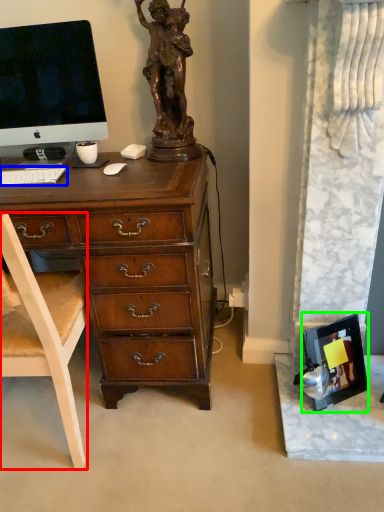
Question: Which object is the closest to the chair (highlighted by a red box)? Choose among these: computer keyboard (highlighted by a blue box) or picture frame (highlighted by a green box).

Choices:
 (A) computer keyboard
 (B) picture frame

Answer: (A)